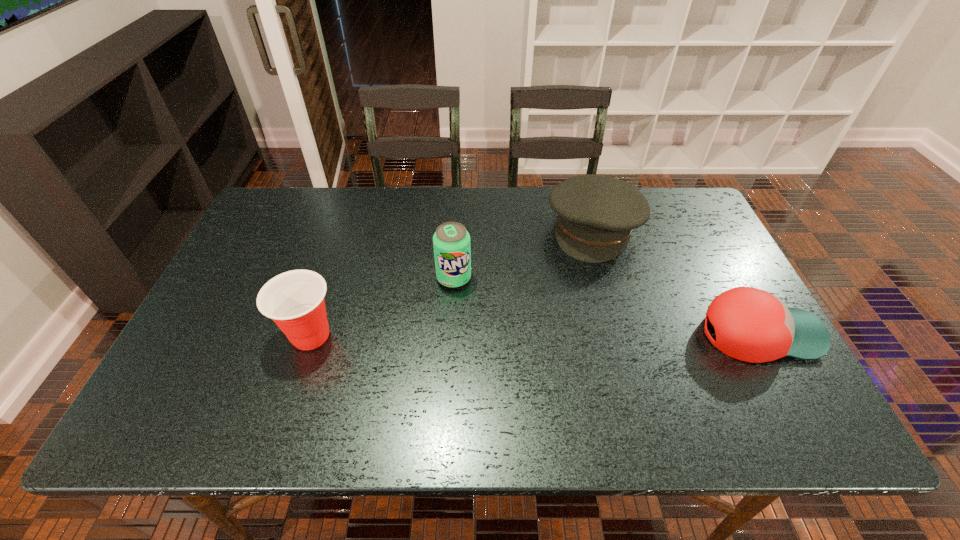
Locate an element on the screen. cup is located at coordinates (294, 300).

The image size is (960, 540). I want to click on the shortest object, so click(x=752, y=325).

Find the location of a particular element. the rightmost object is located at coordinates (752, 325).

This screenshot has height=540, width=960. Identify the location of the second farthest object. coord(452,249).

The height and width of the screenshot is (540, 960). What are the coordinates of `the second object from left to right` in the screenshot? It's located at (452, 249).

The image size is (960, 540). What are the coordinates of `the second object from right to left` in the screenshot? It's located at (596, 214).

You are a GUI agent. You are given a task and a screenshot of the screen. Output one action in this format:
    pyautogui.click(x=<x>, y=<y>)
    Task: Click on the beret
    The width and height of the screenshot is (960, 540).
    Given the screenshot: What is the action you would take?
    pyautogui.click(x=596, y=214)

Find the location of a particular element. Image resolution: width=960 pixels, height=540 pixels. free space located on the right of the leftmost object is located at coordinates (456, 335).

You are a GUI agent. You are given a task and a screenshot of the screen. Output one action in this format:
    pyautogui.click(x=<x>, y=<y>)
    Task: Click on the vacant position located 0.050m on the front-facing side of the pop soda
    Image resolution: width=960 pixels, height=540 pixels.
    Given the screenshot: What is the action you would take?
    pyautogui.click(x=466, y=303)

Find the location of a particular element. vacant space located on the front-facing side of the pop soda is located at coordinates (481, 339).